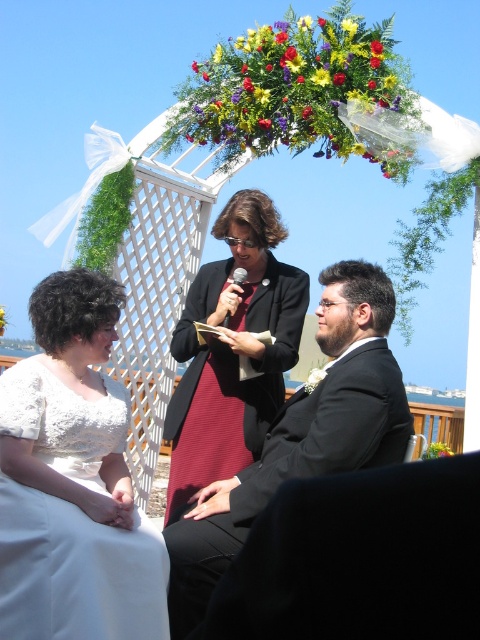
Question: Considering the real-world distances, which object is farthest from the black plastic microphone at center?

Choices:
 (A) maroon textured dress at center
 (B) black satin suit at center

Answer: (A)

Question: Which of the following is the farthest from the observer?

Choices:
 (A) black satin suit at center
 (B) maroon textured dress at center
 (C) white lace dress at lower left
 (D) black plastic microphone at center

Answer: (D)

Question: Which point appears closest to the camera in this image?

Choices:
 (A) (367, 330)
 (B) (180, 381)
 (C) (155, 627)
 (D) (231, 282)

Answer: (C)

Question: Is white lace dress at lower left above maroon textured dress at center?

Choices:
 (A) no
 (B) yes

Answer: (A)

Question: Observing the image, what is the correct spatial positioning of maroon textured dress at center in reference to black plastic microphone at center?

Choices:
 (A) left
 (B) right

Answer: (B)

Question: Observing the image, what is the correct spatial positioning of white lace dress at lower left in reference to black satin suit at center?

Choices:
 (A) left
 (B) right

Answer: (A)